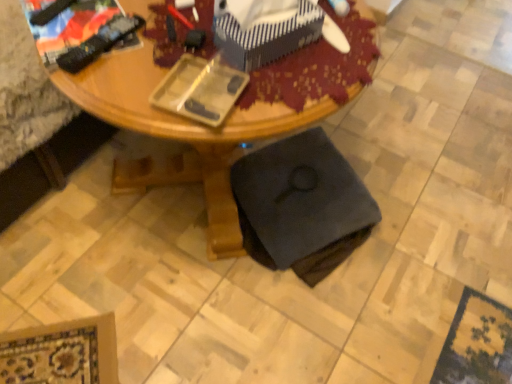
I want to click on free space to the right of blue striped fabric box at upper center, so tap(339, 59).